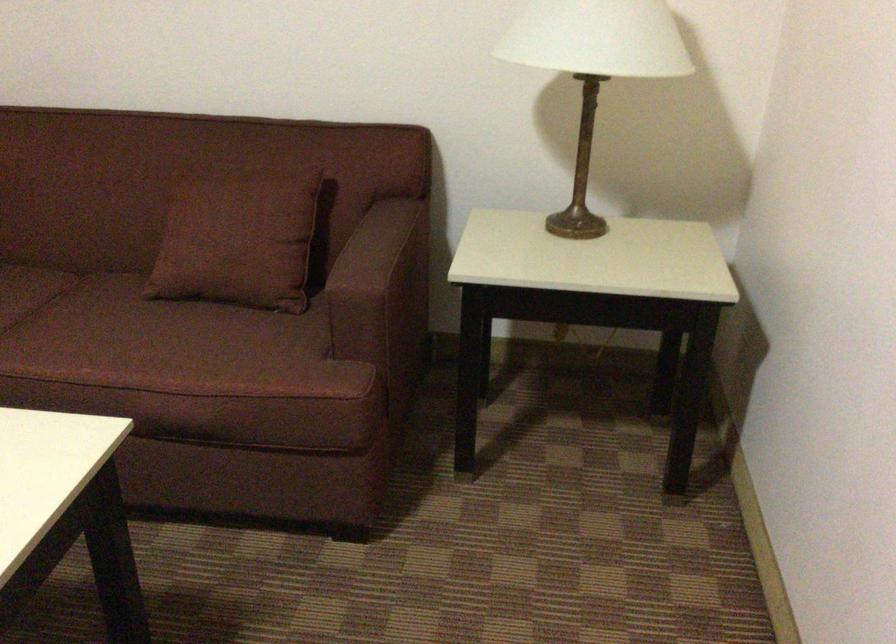
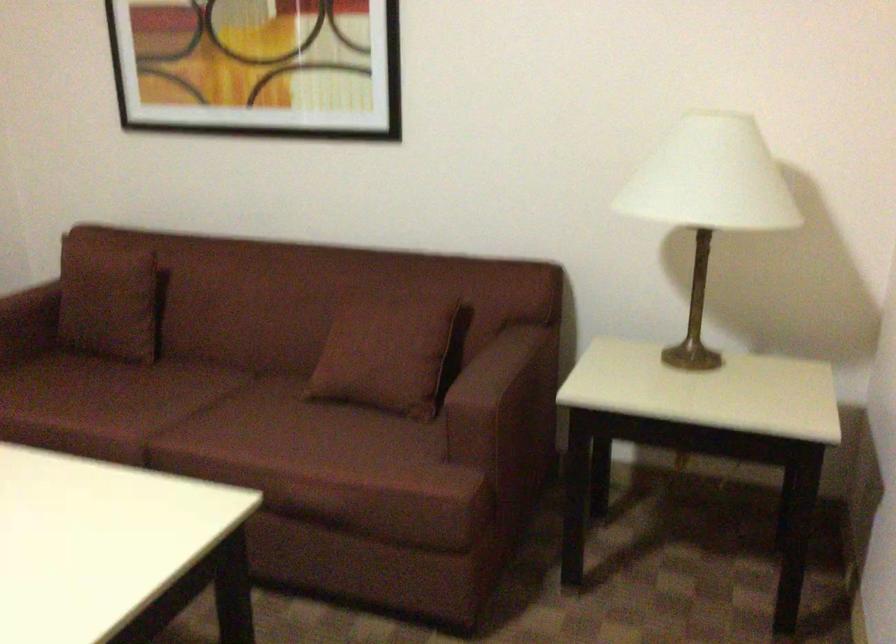
Question: The first image is from the beginning of the video and the second image is from the end. How did the camera likely rotate when shooting the video?

Choices:
 (A) Left
 (B) Right
 (C) Up
 (D) Down

Answer: (A)